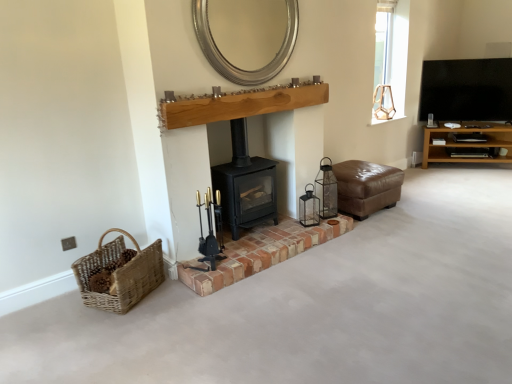
Locate an element on the screen. red brick fireplace at center is located at coordinates (260, 252).

The image size is (512, 384). What do you see at coordinates (467, 143) in the screenshot? I see `brown wooden shelf at right` at bounding box center [467, 143].

Identify the location of black metal fireplace tools at center, which is the first candle holder from front to back. (209, 238).

Describe the element at coordinates (239, 104) in the screenshot. The height and width of the screenshot is (384, 512). I see `natural wood mantle at center` at that location.

What do you see at coordinates (245, 184) in the screenshot? The height and width of the screenshot is (384, 512). I see `black matte wood burning stove at center` at bounding box center [245, 184].

Locate an element on the screen. This screenshot has width=512, height=384. brown leather ottoman at center-right is located at coordinates (366, 187).

Considering the sizes of natural wood mantle at center and silver metallic mirror at upper center in the image, is natural wood mantle at center bigger or smaller than silver metallic mirror at upper center?

In the image, natural wood mantle at center appears to be smaller than silver metallic mirror at upper center.

In terms of width, does natural wood mantle at center look wider or thinner when compared to silver metallic mirror at upper center?

natural wood mantle at center is wider than silver metallic mirror at upper center.

Could you tell me if natural wood mantle at center is facing silver metallic mirror at upper center?

No, natural wood mantle at center is not aimed at silver metallic mirror at upper center.

At what (x,y) coordinates should I click in order to perform the action: click on mantle that appears in front of the silver metallic mirror at upper center. Please return your answer as a coordinate pair (x, y). The height and width of the screenshot is (384, 512). Looking at the image, I should click on (239, 104).

Between metallic lantern at center, which is the second candle holder from left to right, and black matte wood burning stove at center, which one appears on the right side from the viewer's perspective?

From the viewer's perspective, metallic lantern at center, which is the second candle holder from left to right, appears more on the right side.

Is metallic lantern at center, which is the second candle holder from left to right, in contact with black matte wood burning stove at center?

metallic lantern at center, which is the second candle holder from left to right, and black matte wood burning stove at center are not in contact.

From the image's perspective, does metallic lantern at center, the second candle holder in the front-to-back sequence, appear lower than black matte wood burning stove at center?

Yes.

Which of these two, metallic lantern at center, which is the second candle holder from left to right, or black matte wood burning stove at center, stands taller?

black matte wood burning stove at center is taller.

Could you tell me if clear glass window at upper right is turned towards black glossy tv at upper right?

No, clear glass window at upper right is not oriented towards black glossy tv at upper right.

Is point (405, 83) behind point (434, 136)?

No, it is not.

In the scene shown: Is clear glass window at upper right not near black glossy tv at upper right?

No, clear glass window at upper right is in close proximity to black glossy tv at upper right.

Can you confirm if clear glass window at upper right is shorter than black glossy tv at upper right?

In fact, clear glass window at upper right may be taller than black glossy tv at upper right.

Based on the photo, between metallic lantern at center, acting as the first candle holder starting from the back, and brown leather ottoman at center-right, which one has smaller size?

Smaller between the two is metallic lantern at center, acting as the first candle holder starting from the back.

Between metallic lantern at center, acting as the first candle holder starting from the back, and brown leather ottoman at center-right, which one appears on the left side from the viewer's perspective?

From the viewer's perspective, metallic lantern at center, acting as the first candle holder starting from the back, appears more on the left side.

Is point (306, 222) closer or farther from the camera than point (347, 202)?

Point (306, 222) is closer to the camera than point (347, 202).

From the image's perspective, is metallic lantern at center, the second candle holder in the front-to-back sequence, located above brown leather ottoman at center-right?

Actually, metallic lantern at center, the second candle holder in the front-to-back sequence, appears below brown leather ottoman at center-right in the image.

Considering the sizes of woven natural basket at lower left and black metal fireplace tools at center, which is the first candle holder from front to back, in the image, is woven natural basket at lower left wider or thinner than black metal fireplace tools at center, which is the first candle holder from front to back,?

woven natural basket at lower left is wider than black metal fireplace tools at center, which is the first candle holder from front to back.

Considering the relative positions of woven natural basket at lower left and black metal fireplace tools at center, which ranks as the second candle holder in right-to-left order, in the image provided, is woven natural basket at lower left to the right of black metal fireplace tools at center, which ranks as the second candle holder in right-to-left order, from the viewer's perspective?

No, woven natural basket at lower left is not to the right of black metal fireplace tools at center, which ranks as the second candle holder in right-to-left order.

Starting from the woven natural basket at lower left, which candle holder is the 1st one behind? Please provide its 2D coordinates.

[(209, 238)]

Do you think woven natural basket at lower left is within black metal fireplace tools at center, the 2th candle holder in the back-to-front sequence, or outside of it?

woven natural basket at lower left lies outside black metal fireplace tools at center, the 2th candle holder in the back-to-front sequence.

Is silver metallic mirror at upper center at the right side of black glossy tv at upper right?

Incorrect, silver metallic mirror at upper center is not on the right side of black glossy tv at upper right.

Is there a large distance between silver metallic mirror at upper center and black glossy tv at upper right?

Yes, silver metallic mirror at upper center and black glossy tv at upper right are quite far apart.

Identify the location of entertainment center located underneath the silver metallic mirror at upper center (from a real-world perspective). (467, 106).

Between silver metallic mirror at upper center and black glossy tv at upper right, which one has smaller width?

Thinner between the two is silver metallic mirror at upper center.

From the image's perspective, between silver metallic mirror at upper center and brown leather ottoman at center-right, which one is located above?

silver metallic mirror at upper center.

Is silver metallic mirror at upper center with brown leather ottoman at center-right?

silver metallic mirror at upper center and brown leather ottoman at center-right are not in contact.

From the picture: From a real-world perspective, which is physically above, silver metallic mirror at upper center or brown leather ottoman at center-right?

From a 3D spatial view, silver metallic mirror at upper center is above.

There is a natural wood mantle at center. What are the coordinates of `fireplace above it (from a real-world perspective)` in the screenshot? It's located at point(232,64).

From a real-world perspective, starting from the black matte wood burning stove at center, which candle holder is the 2nd one below it? Please provide its 2D coordinates.

[(309, 208)]

From the picture: Considering their positions, is black glossy tv at upper right positioned further to brown leather ottoman at center-right than black metal fireplace tools at center, which ranks as the second candle holder in right-to-left order?

Among the two, black glossy tv at upper right is located further to brown leather ottoman at center-right.

Considering their positions, is metallic lantern at center, which is the second candle holder from left to right, positioned further to red brick fireplace at center than natural wood mantle at center?

natural wood mantle at center lies further to red brick fireplace at center than the other object.

Based on their spatial positions, is brown wooden shelf at right or metallic lantern at center, which is the second candle holder from left to right, further from brown leather ottoman at center-right?

brown wooden shelf at right is positioned further to the anchor brown leather ottoman at center-right.

Estimate the real-world distances between objects in this image. Which object is further from red brick fireplace at center, clear glass window at upper right or woven natural basket at lower left?

Among the two, clear glass window at upper right is located further to red brick fireplace at center.

Based on their spatial positions, is brown leather ottoman at center-right or silver metallic mirror at upper center further from black matte wood burning stove at center?

brown leather ottoman at center-right is positioned further to the anchor black matte wood burning stove at center.

From the image, which object appears to be nearer to black glossy tv at upper right, metallic lantern at center, acting as the first candle holder starting from the back, or red brick fireplace at center?

red brick fireplace at center.

Looking at the image, which one is located closer to brown leather ottoman at center-right, metallic lantern at center, acting as the first candle holder starting from the back, or natural wood mantle at center?

Among the two, metallic lantern at center, acting as the first candle holder starting from the back, is located nearer to brown leather ottoman at center-right.

When comparing their distances from natural wood mantle at center, does brown wooden shelf at right or metallic lantern at center, acting as the first candle holder starting from the back, seem closer?

metallic lantern at center, acting as the first candle holder starting from the back, is positioned closer to the anchor natural wood mantle at center.

The image size is (512, 384). Identify the location of armchair between black matte wood burning stove at center and brown wooden shelf at right in the horizontal direction. (366, 187).

Where is `window between silver metallic mirror at upper center and brown wooden shelf at right in the horizontal direction`? The width and height of the screenshot is (512, 384). window between silver metallic mirror at upper center and brown wooden shelf at right in the horizontal direction is located at coordinates (391, 57).

I want to click on window between black matte wood burning stove at center and black glossy tv at upper right from left to right, so click(x=391, y=57).

In order to click on wood burning stove between red brick fireplace at center and metallic lantern at center, which is the second candle holder from left to right, along the z-axis in this screenshot , I will do `click(245, 184)`.